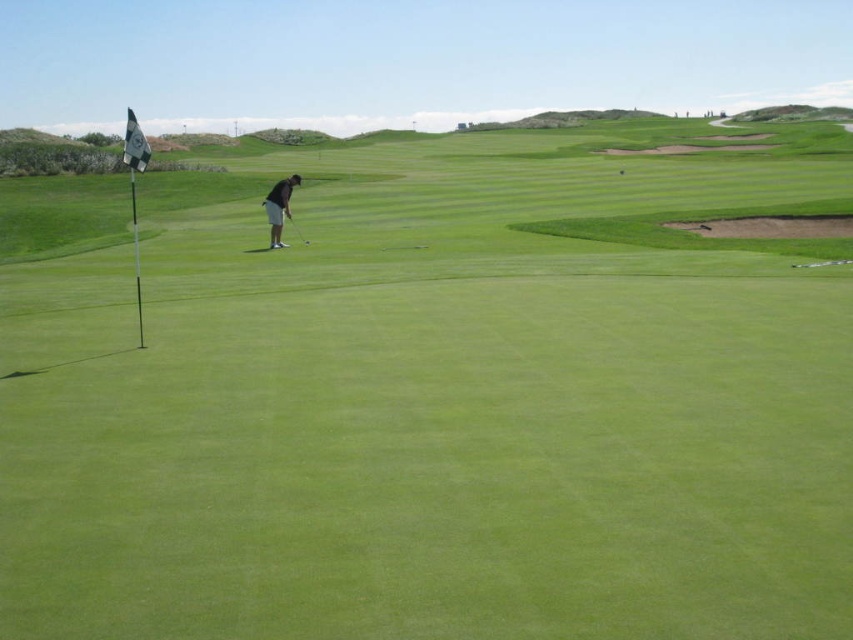
Who is positioned more to the left, dark gray pants at center or metallic silver golf club at center?

dark gray pants at center

Between point (271, 243) and point (287, 216), which one is positioned in front?

Positioned in front is point (271, 243).

The image size is (853, 640). What are the coordinates of `dark gray pants at center` in the screenshot? It's located at (279, 208).